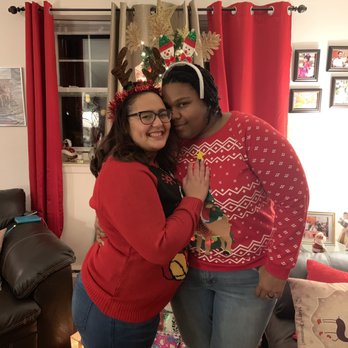
Locate an element on the screen. The width and height of the screenshot is (348, 348). the top of red pillow is located at coordinates (327, 275).